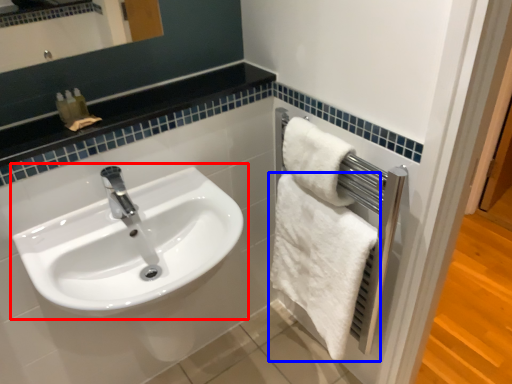
Question: Which point is further to the camera, sink (highlighted by a red box) or towel (highlighted by a blue box)?

Choices:
 (A) sink
 (B) towel

Answer: (B)